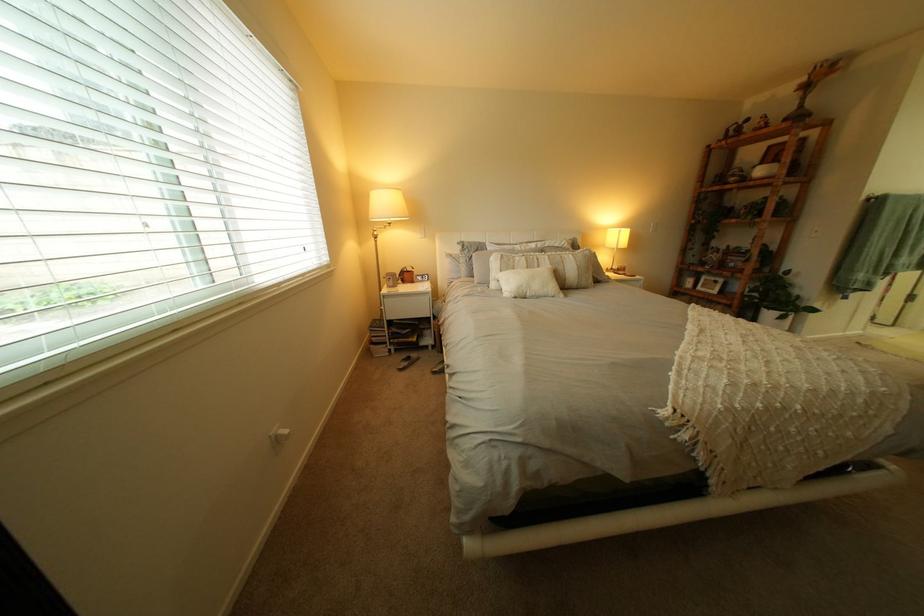
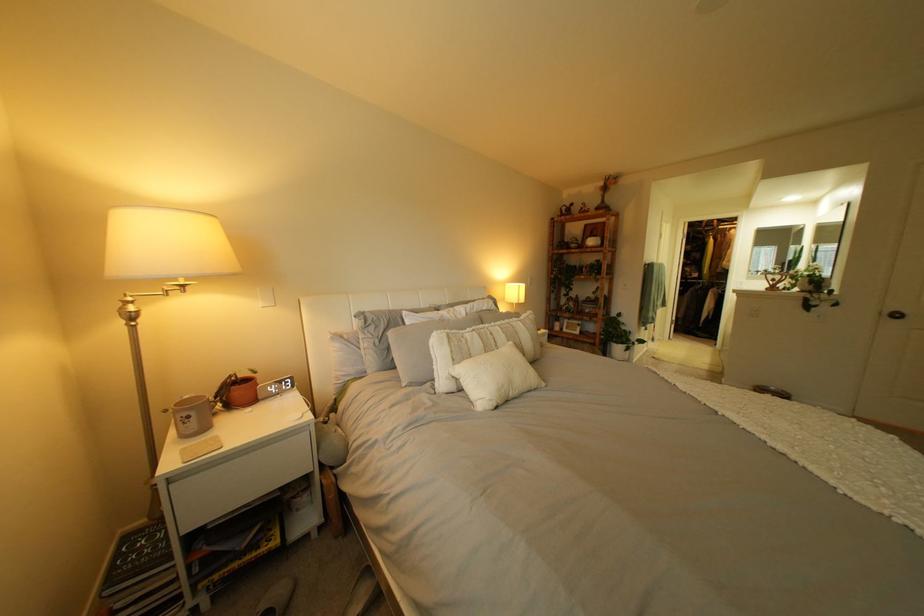
Locate, in the second image, the point that corresponds to (x=407, y=281) in the first image.

(209, 419)